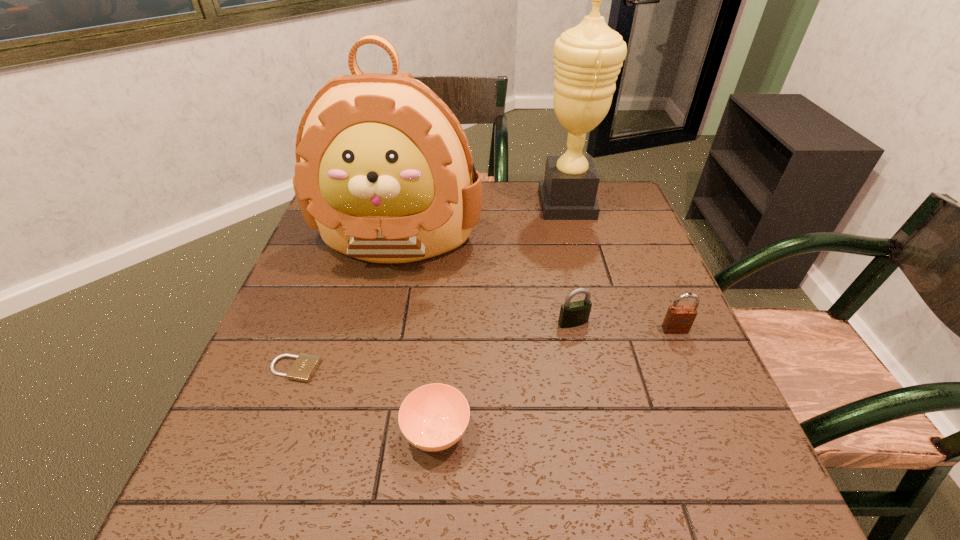
You are a GUI agent. You are given a task and a screenshot of the screen. Output one action in this format:
    pyautogui.click(x=<x>, y=<y>)
    Task: Click on the free space between the fifth shortest object and the rightmost object
    
    Given the screenshot: What is the action you would take?
    pyautogui.click(x=537, y=283)

Image resolution: width=960 pixels, height=540 pixels. Identify the location of vacant area between the rightmost padlock and the trophy cup. (621, 267).

Identify the location of free space between the rightmost padlock and the trophy cup. (621, 267).

Locate an element on the screen. The image size is (960, 540). vacant region between the rightmost padlock and the backpack is located at coordinates (537, 283).

Identify the location of free space that is in between the trophy cup and the soup bowl. Image resolution: width=960 pixels, height=540 pixels. (501, 318).

Identify the location of vacant area that lies between the fifth farthest object and the backpack. This screenshot has width=960, height=540. (347, 303).

Find the location of a particular element. vacant area that lies between the backpack and the trophy cup is located at coordinates (482, 220).

The image size is (960, 540). I want to click on vacant space that's between the second tallest object and the rightmost object, so click(537, 283).

You are a GUI agent. You are given a task and a screenshot of the screen. Output one action in this format:
    pyautogui.click(x=<x>, y=<y>)
    Task: Click on the free space between the leftmost padlock and the nearest object
    
    Given the screenshot: What is the action you would take?
    pyautogui.click(x=366, y=401)

Where is `free space between the backpack and the second padlock from left to right`? The height and width of the screenshot is (540, 960). free space between the backpack and the second padlock from left to right is located at coordinates (486, 280).